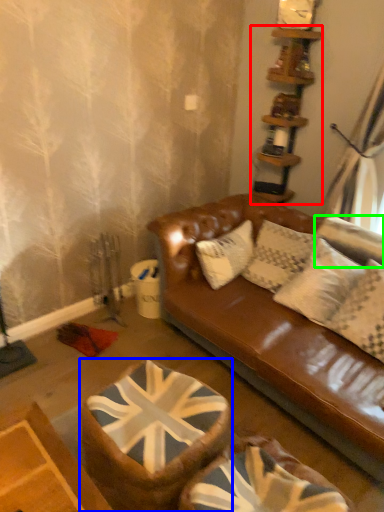
Question: Considering the real-world distances, which object is closest to shelf (highlighted by a red box)? swivel chair (highlighted by a blue box) or pillow (highlighted by a green box).

Choices:
 (A) swivel chair
 (B) pillow

Answer: (B)